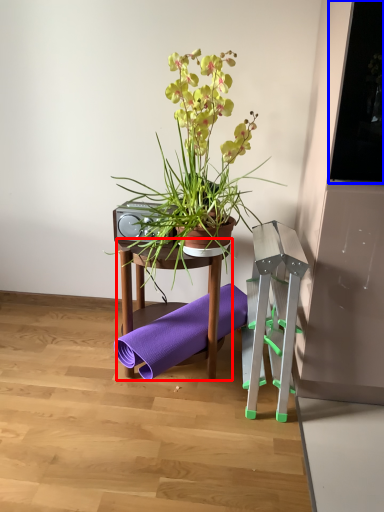
Question: Which object appears closest to the camera in this image, table (highlighted by a red box) or window screen (highlighted by a blue box)?

Choices:
 (A) table
 (B) window screen

Answer: (B)